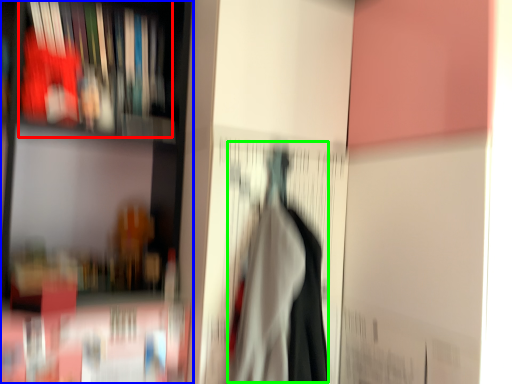
Question: Which object is the farthest from book (highlighted by a red box)? Choose among these: shelf (highlighted by a blue box) or woman (highlighted by a green box).

Choices:
 (A) shelf
 (B) woman

Answer: (B)